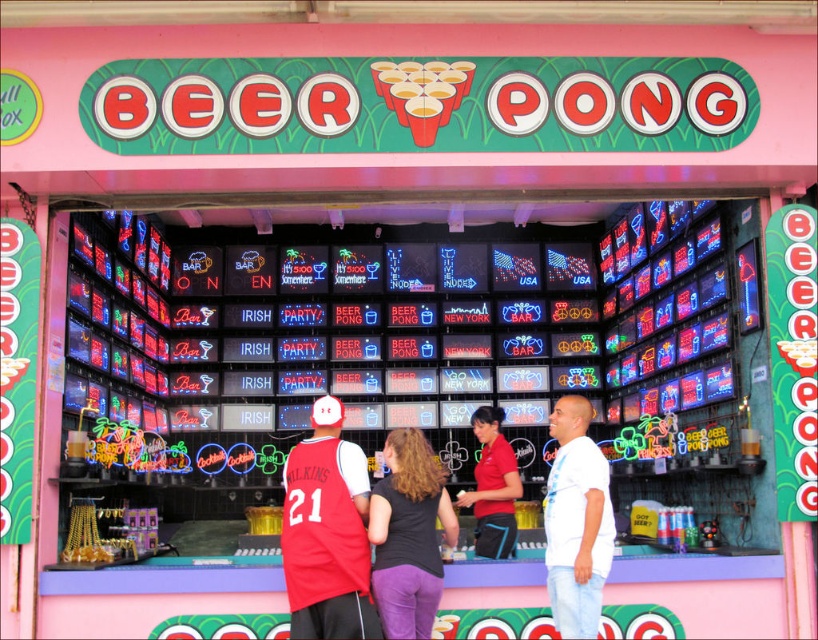
You are a photographer at the beer pong booth and want to take a photo of the red jersey at center and the white cotton shirt at center. Which one would appear closer to the camera in the photo?

The red jersey at center is in front of the white cotton shirt at center, so it would appear closer to the camera in the photo.

You are standing at the entrance of the beer pong booth and want to place a new neon sign at the exact center of the booth. However, there is already a red jersey at center. Where should you place the new neon sign?

The red jersey at center is already located at the exact center of the booth, so you should place the new neon sign at the same position as the red jersey at center.

You are a carnival game operator standing at the entrance of the beer pong booth. You need to place a new prize shelf between the red jersey at center and the white cotton shirt at center. The shelf requires 8 feet of space. Is there enough space between them for the shelf?

The distance between the red jersey at center and the white cotton shirt at center is 9.15 feet, which is more than the required 8 feet. Therefore, there is enough space to place the shelf between them.